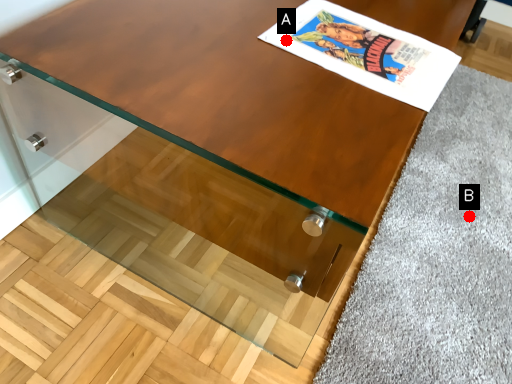
Question: Two points are circled on the image, labeled by A and B beside each circle. Which of the following is the closest to the observer?

Choices:
 (A) A is closer
 (B) B is closer

Answer: (A)